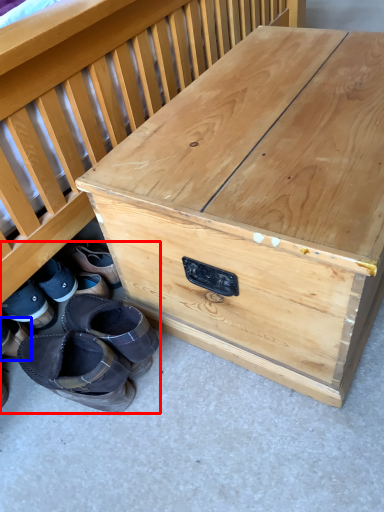
Question: Which of the following is the farthest to the observer, footwear (highlighted by a red box) or footwear (highlighted by a blue box)?

Choices:
 (A) footwear
 (B) footwear

Answer: (B)